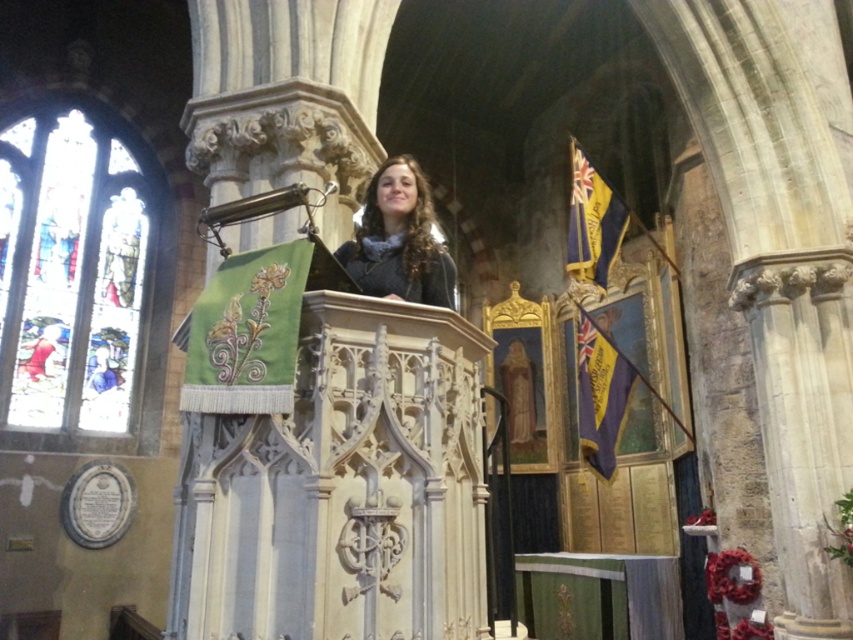
Question: Does stained glass window at left have a smaller size compared to gray wool scarf at center?

Choices:
 (A) yes
 (B) no

Answer: (B)

Question: Considering the relative positions of stained glass window at left and gray wool scarf at center in the image provided, where is stained glass window at left located with respect to gray wool scarf at center?

Choices:
 (A) left
 (B) right

Answer: (A)

Question: Is stained glass window at left further to the viewer compared to gray wool scarf at center?

Choices:
 (A) no
 (B) yes

Answer: (B)

Question: Which point is closer to the camera?

Choices:
 (A) gray wool scarf at center
 (B) stained glass window at left

Answer: (A)